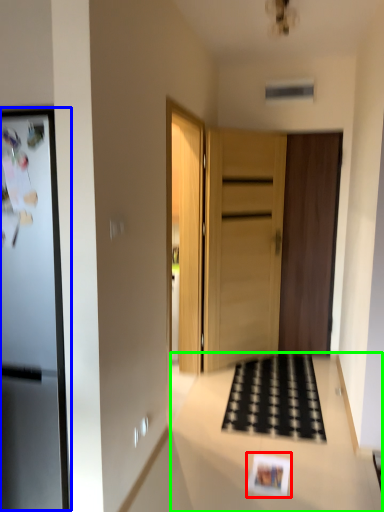
Question: Which is nearer to the postcard (highlighted by a red box)? fridge (highlighted by a blue box) or counter top (highlighted by a green box).

Choices:
 (A) fridge
 (B) counter top

Answer: (B)